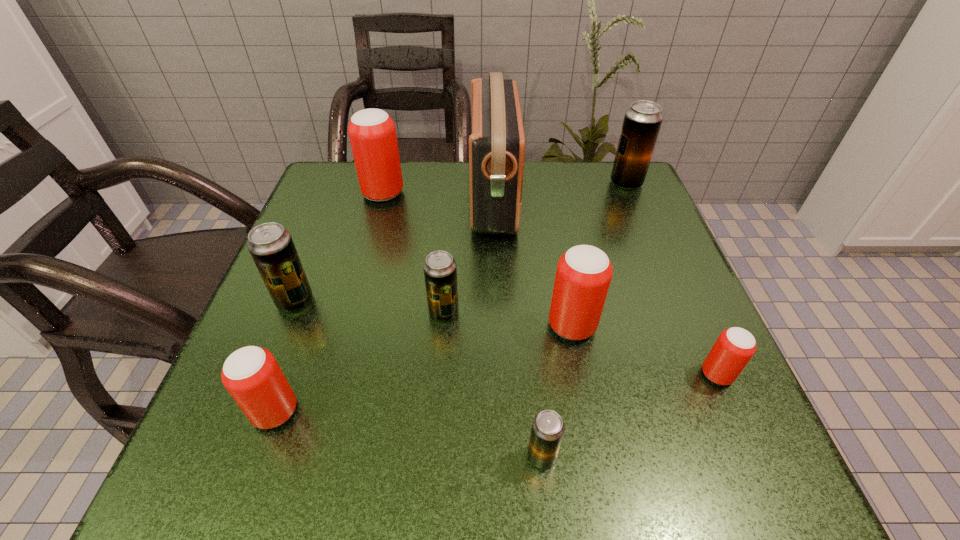
At what (x,y) coordinates should I click in order to perform the action: click on free area in between the nearest red beer can and the farthest red beer can. Please return your answer as a coordinate pair (x, y). The width and height of the screenshot is (960, 540). Looking at the image, I should click on (329, 302).

I want to click on vacant space in between the second biggest black beer can and the farthest black beer can, so click(x=461, y=242).

Locate an element on the screen. vacant space that is in between the nearest red beer can and the third red beer can from left to right is located at coordinates (423, 369).

Locate an element on the screen. free space between the third nearest red beer can and the sixth object from right to left is located at coordinates (508, 319).

The width and height of the screenshot is (960, 540). I want to click on vacant area that lies between the biggest black beer can and the leftmost black beer can, so click(x=461, y=242).

Where is `unoccupied position between the nearest object and the leftmost black beer can`? The height and width of the screenshot is (540, 960). unoccupied position between the nearest object and the leftmost black beer can is located at coordinates (419, 379).

Identify the location of the seventh closest object to the biggest red beer can. The image size is (960, 540). (548, 427).

Find the location of a particular element. object that is the eighth closest to the seventh farthest object is located at coordinates (372, 133).

Choose which beer can is the fourth nearest neighbor to the radio receiver. Please provide its 2D coordinates. Your answer should be formatted as a tuple, i.e. [(x, y)], where the tuple contains the x and y coordinates of a point satisfying the conditions above.

[(642, 121)]

In order to click on the sixth closest beer can to the tallest object in this screenshot , I will do `click(735, 346)`.